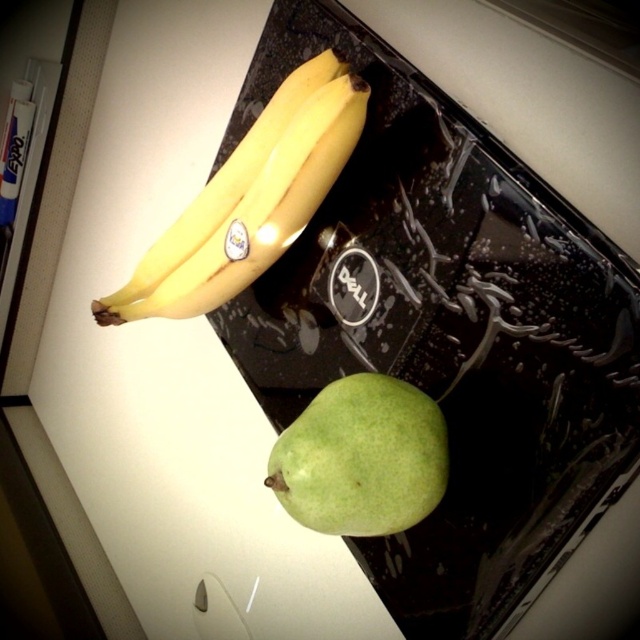
Which of these two, yellow matte banana at upper left or green matte pear at lower center, stands taller?

With more height is yellow matte banana at upper left.

Can you confirm if yellow matte banana at upper left is thinner than green matte pear at lower center?

No, yellow matte banana at upper left is not thinner than green matte pear at lower center.

Between point (237, 161) and point (355, 412), which one is positioned in front?

Positioned in front is point (355, 412).

At what (x,y) coordinates should I click in order to perform the action: click on yellow matte banana at upper left. Please return your answer as a coordinate pair (x, y). This screenshot has width=640, height=640. Looking at the image, I should click on (250, 198).